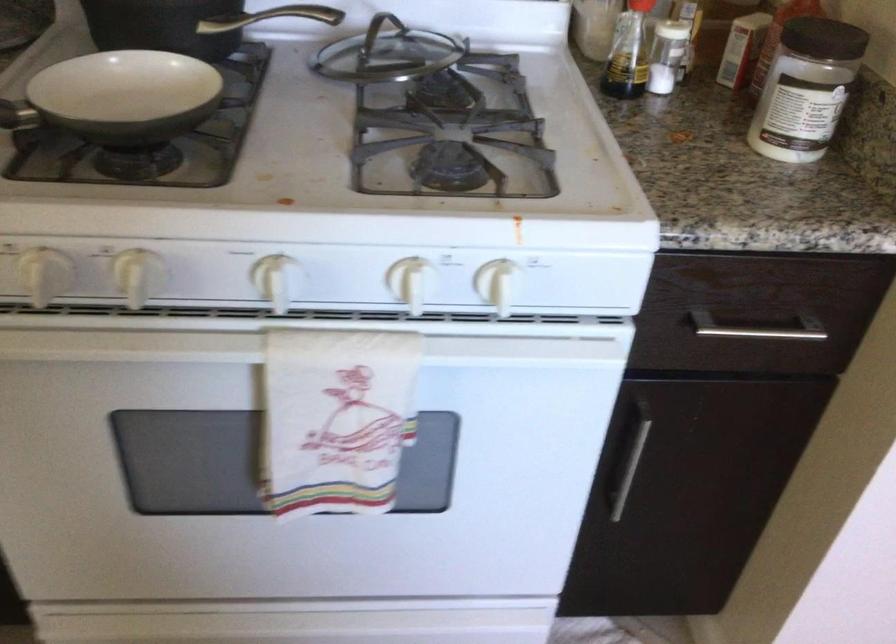
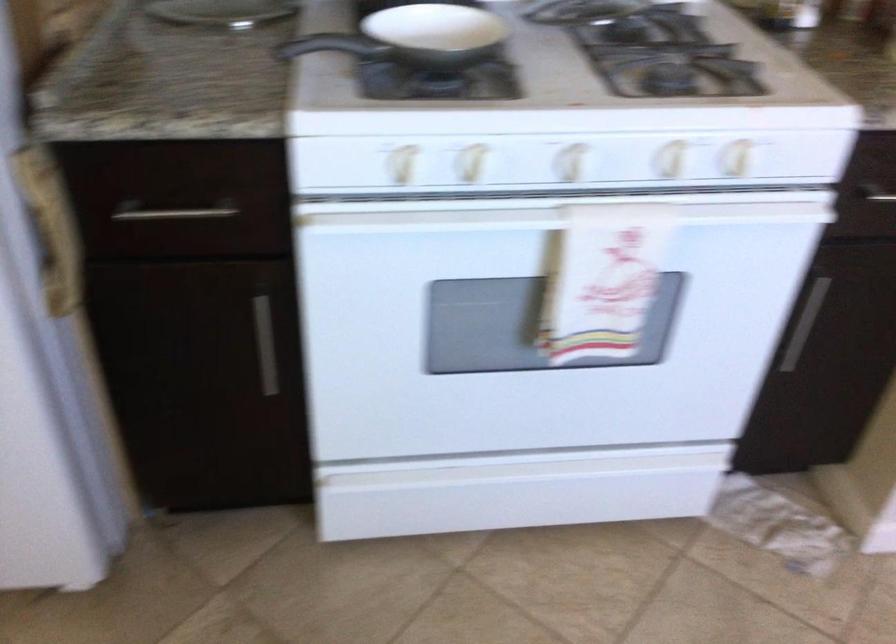
The point at (501, 287) is marked in the first image. Where is the corresponding point in the second image?

(737, 158)